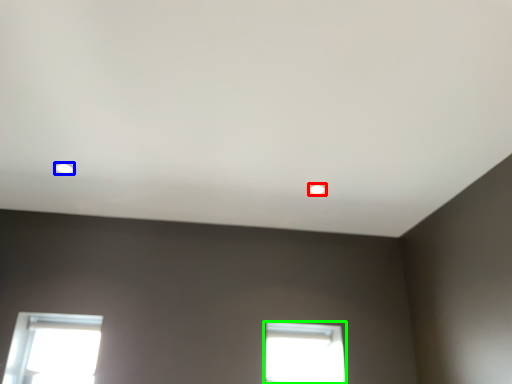
Question: Estimate the real-world distances between objects in this image. Which object is closer to lighting (highlighted by a red box), lighting (highlighted by a blue box) or window (highlighted by a green box)?

Choices:
 (A) lighting
 (B) window

Answer: (B)